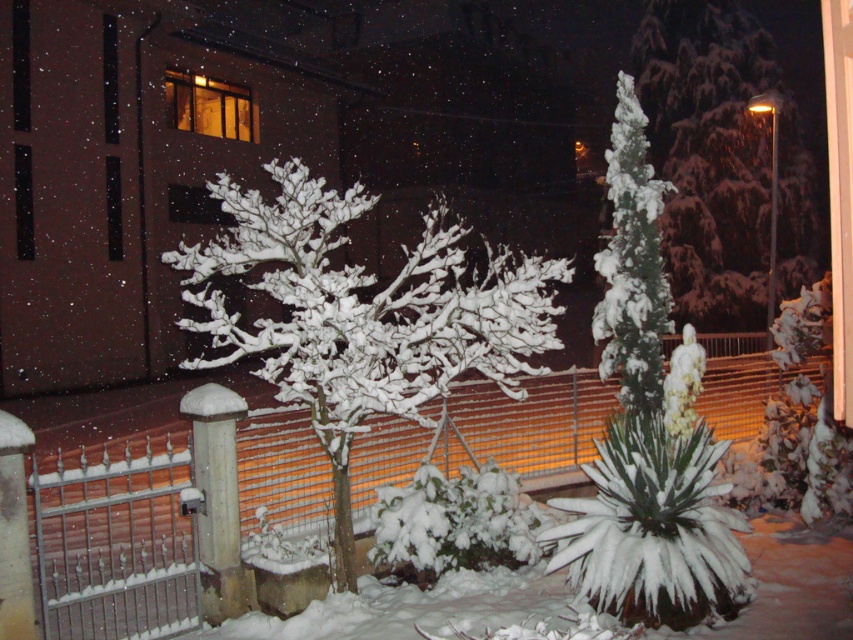
Between snow-covered evergreen at upper right and white fluffy tree at right, which one appears on the right side from the viewer's perspective?

snow-covered evergreen at upper right is more to the right.

Who is more distant from viewer, (756, 259) or (648, 216)?

The point (756, 259) is behind.

Between point (706, 205) and point (663, 276), which one is positioned behind?

Positioned behind is point (706, 205).

Image resolution: width=853 pixels, height=640 pixels. Find the location of `snow-covered evergreen at upper right`. snow-covered evergreen at upper right is located at coordinates (722, 161).

Can you confirm if snow-covered branches at center is wider than white fluffy tree at right?

Correct, the width of snow-covered branches at center exceeds that of white fluffy tree at right.

Which is in front, point (349, 502) or point (631, 292)?

Point (349, 502) is more forward.

Between point (494, 259) and point (642, 195), which one is positioned in front?

Point (642, 195)

At what (x,y) coordinates should I click in order to perform the action: click on snow-covered branches at center. Please return your answer as a coordinate pair (x, y). The image size is (853, 640). Looking at the image, I should click on point(363,316).

Does metallic wire fence at center have a lesser width compared to snow-covered branches at center?

No.

Image resolution: width=853 pixels, height=640 pixels. In order to click on metallic wire fence at center in this screenshot , I will do `click(114, 538)`.

Find the location of a particular element. This screenshot has height=640, width=853. metallic wire fence at center is located at coordinates (114, 538).